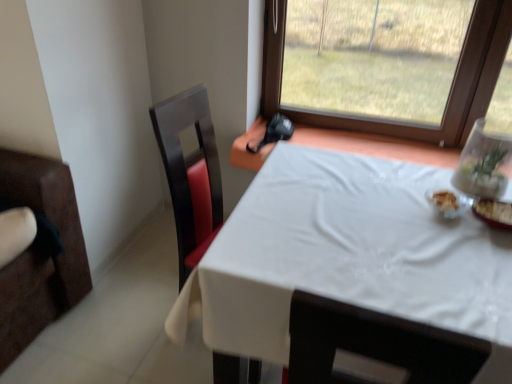
Question: Is white cloth-covered table at center far away from matte black swivel chair at left?

Choices:
 (A) yes
 (B) no

Answer: (B)

Question: From a real-world perspective, is white cloth-covered table at center positioned over matte black swivel chair at left based on gravity?

Choices:
 (A) no
 (B) yes

Answer: (A)

Question: Does white cloth-covered table at center have a smaller size compared to matte black swivel chair at left?

Choices:
 (A) yes
 (B) no

Answer: (B)

Question: Is white cloth-covered table at center placed right next to matte black swivel chair at left?

Choices:
 (A) yes
 (B) no

Answer: (B)

Question: From the image's perspective, would you say white cloth-covered table at center is shown under matte black swivel chair at left?

Choices:
 (A) no
 (B) yes

Answer: (B)

Question: From a real-world perspective, is white cloth-covered table at center positioned above or below white glossy bowl at upper right?

Choices:
 (A) above
 (B) below

Answer: (B)

Question: Based on their sizes in the image, would you say white cloth-covered table at center is bigger or smaller than white glossy bowl at upper right?

Choices:
 (A) small
 (B) big

Answer: (B)

Question: Considering the positions of white cloth-covered table at center and white glossy bowl at upper right in the image, is white cloth-covered table at center taller or shorter than white glossy bowl at upper right?

Choices:
 (A) short
 (B) tall

Answer: (B)

Question: Is white cloth-covered table at center wider or thinner than white glossy bowl at upper right?

Choices:
 (A) thin
 (B) wide

Answer: (B)

Question: Considering the positions of white cloth-covered table at center and transparent glass vase at upper right in the image, is white cloth-covered table at center bigger or smaller than transparent glass vase at upper right?

Choices:
 (A) big
 (B) small

Answer: (A)

Question: Would you say white cloth-covered table at center is to the left or to the right of transparent glass vase at upper right in the picture?

Choices:
 (A) right
 (B) left

Answer: (B)

Question: Does point (278, 304) appear closer or farther from the camera than point (492, 173)?

Choices:
 (A) farther
 (B) closer

Answer: (B)

Question: From a real-world perspective, is white cloth-covered table at center above or below transparent glass vase at upper right?

Choices:
 (A) below
 (B) above

Answer: (A)

Question: Is transparent glass vase at upper right in front of or behind matte black swivel chair at left in the image?

Choices:
 (A) behind
 (B) front

Answer: (A)

Question: Considering the positions of transparent glass vase at upper right and matte black swivel chair at left in the image, is transparent glass vase at upper right wider or thinner than matte black swivel chair at left?

Choices:
 (A) wide
 (B) thin

Answer: (B)